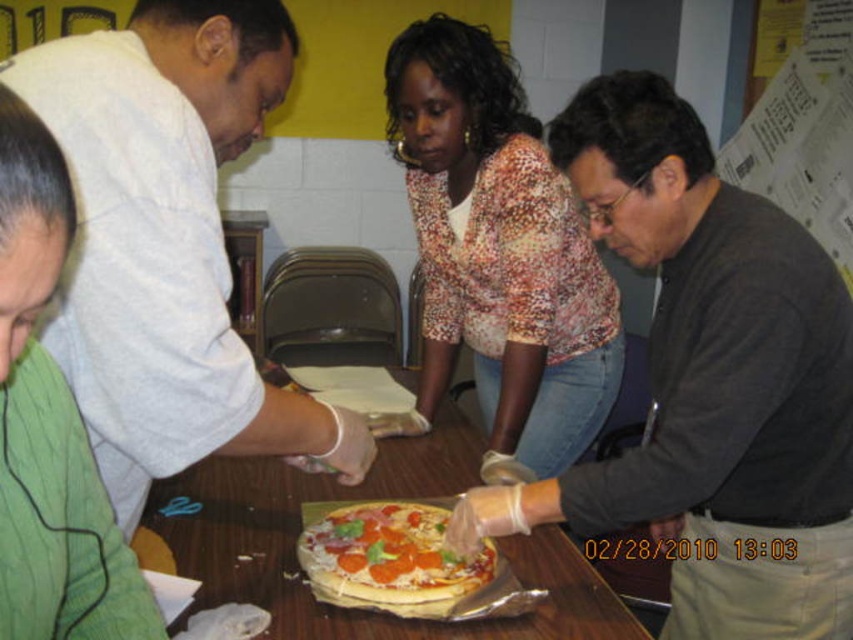
Based on the scene description, where is the printed fabric blouse at center located in terms of coordinates?

The printed fabric blouse at center is located at point (497, 252).

You are standing in front of the table where the group is gathered. There are two points marked on the table surface. The first point is at coordinate (753, 397) and the second at (758, 113). Which point is closer to you?

The point at coordinate (753, 397) is closer to the viewer than the point at (758, 113).

You are a photographer standing in the room. You want to take a photo of the white paper at upper right without the matte black shirt at center blocking it. How should you adjust your position?

Move to the side so that the matte black shirt at center is no longer blocking the view of the white paper at upper right.